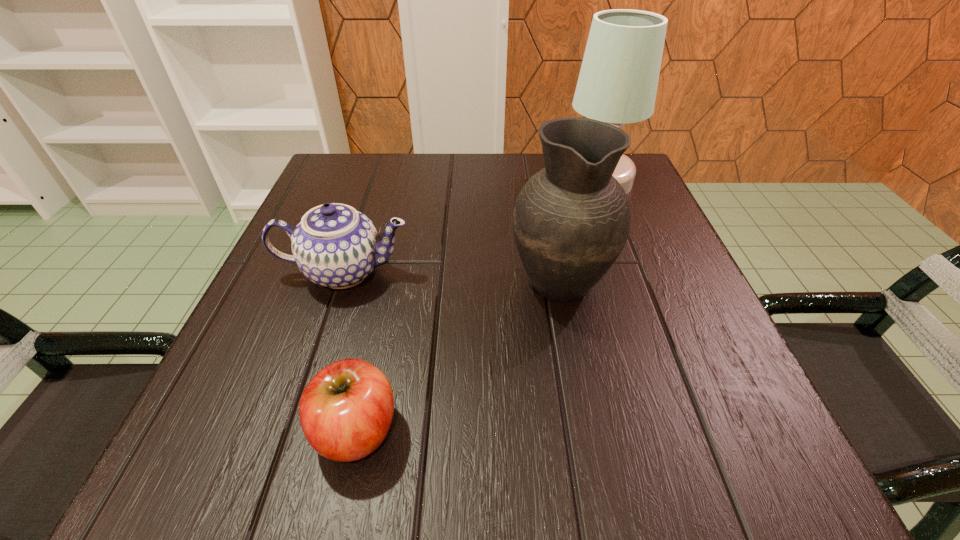
The width and height of the screenshot is (960, 540). In order to click on lampshade in this screenshot , I will do `click(618, 80)`.

This screenshot has height=540, width=960. Identify the location of the farthest object. (618, 80).

Identify the location of the second tallest object. (571, 220).

Locate an element on the screen. The width and height of the screenshot is (960, 540). the third tallest object is located at coordinates (335, 246).

At what (x,y) coordinates should I click in order to perform the action: click on apple. Please return your answer as a coordinate pair (x, y). This screenshot has width=960, height=540. Looking at the image, I should click on (346, 410).

Find the location of a particular element. This screenshot has width=960, height=540. the shortest object is located at coordinates (346, 410).

Where is `vacant space located 0.170m on the base of the lampshade`? This screenshot has height=540, width=960. vacant space located 0.170m on the base of the lampshade is located at coordinates (489, 180).

Where is `free region located 0.360m on the base of the lampshade`? The width and height of the screenshot is (960, 540). free region located 0.360m on the base of the lampshade is located at coordinates (406, 180).

You are a GUI agent. You are given a task and a screenshot of the screen. Output one action in this format:
    pyautogui.click(x=<x>, y=<y>)
    Task: Click on the vacant space located on the base of the lampshade
    Image resolution: width=960 pixels, height=540 pixels.
    Given the screenshot: What is the action you would take?
    pyautogui.click(x=537, y=180)

The image size is (960, 540). Identify the location of vacant space located 0.230m on the side of the pitcher with the handle. (540, 182).